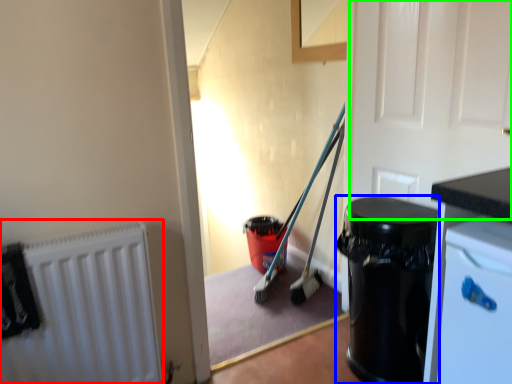
Question: Based on their relative distances, which object is nearer to radiator (highlighted by a red box)? Choose from garbage (highlighted by a blue box) and door (highlighted by a green box).

Choices:
 (A) garbage
 (B) door

Answer: (A)